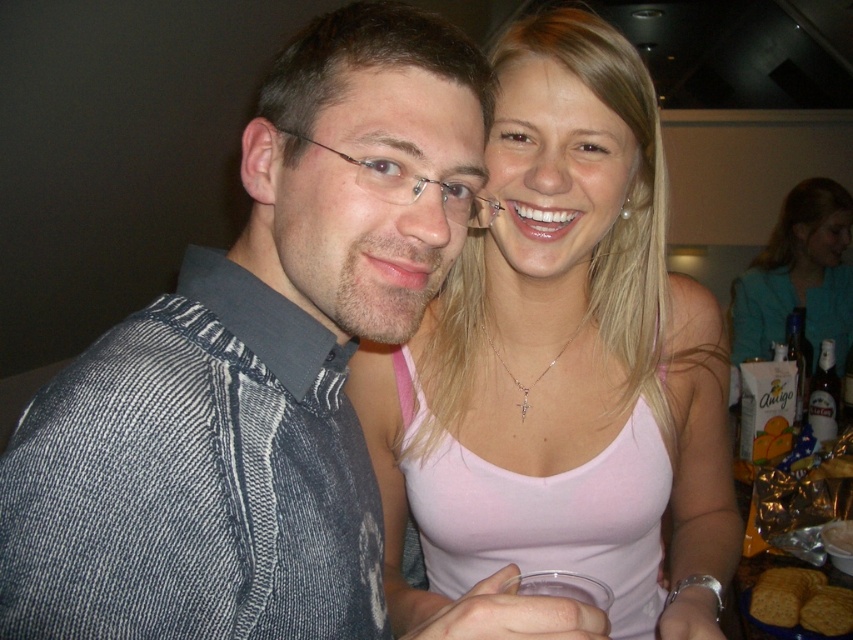
Question: Which of the following is the closest to the observer?

Choices:
 (A) brown glass bottle at right
 (B) pink fabric tank top at upper right
 (C) denim shirt at left
 (D) pink fabric tank top at upper center

Answer: (C)

Question: Estimate the real-world distances between objects in this image. Which object is closer to the pink fabric tank top at upper right?

Choices:
 (A) denim shirt at left
 (B) brown glass bottle at right
 (C) pink fabric tank top at upper center

Answer: (B)

Question: Where is pink fabric tank top at upper right located in relation to brown glass bottle at right in the image?

Choices:
 (A) right
 (B) left

Answer: (A)

Question: Can you confirm if pink fabric tank top at upper right is positioned above brown glass bottle at right?

Choices:
 (A) yes
 (B) no

Answer: (A)

Question: Among these points, which one is farthest from the camera?

Choices:
 (A) (140, 458)
 (B) (821, 342)
 (C) (589, 264)
 (D) (769, 326)

Answer: (D)

Question: Is pink fabric tank top at upper center to the right of pink fabric tank top at upper right from the viewer's perspective?

Choices:
 (A) no
 (B) yes

Answer: (A)